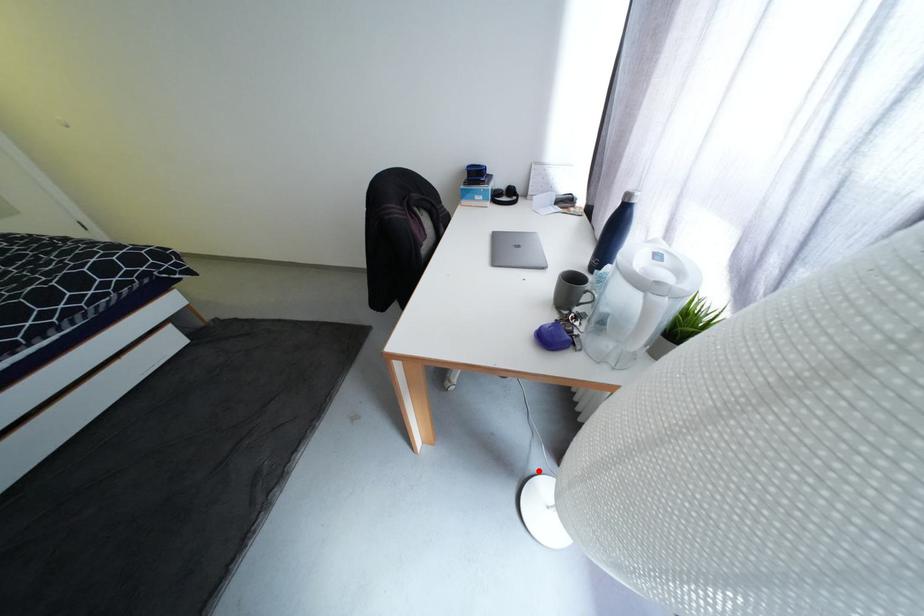
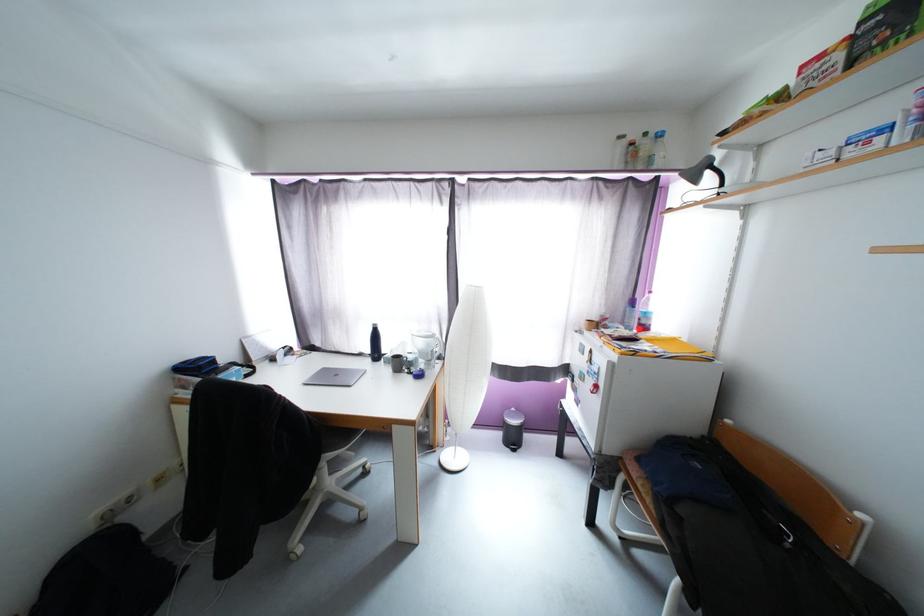
The point at the highlighted location is marked in the first image. Where is the corresponding point in the second image?

(442, 464)